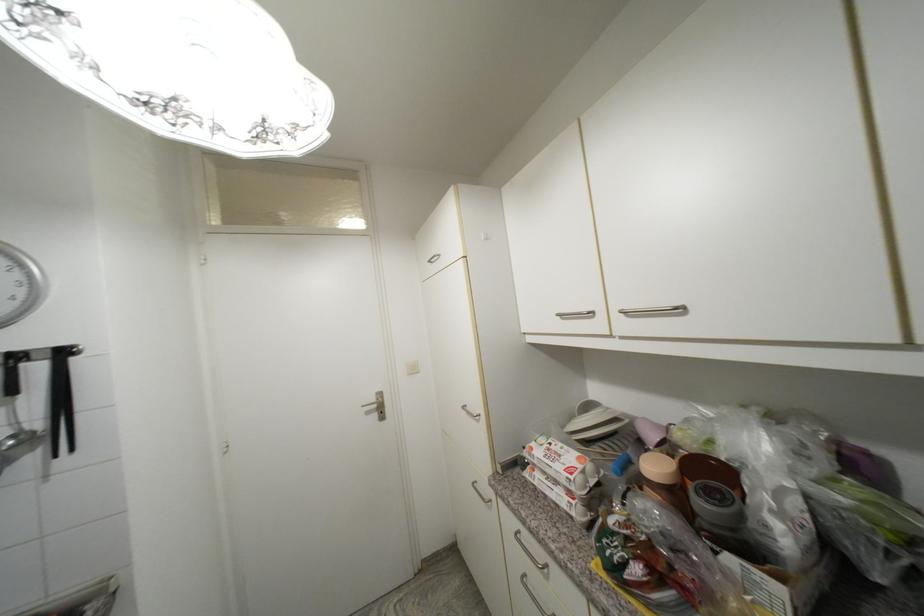
This screenshot has height=616, width=924. What do you see at coordinates (62, 399) in the screenshot?
I see `the black kitchen tongs` at bounding box center [62, 399].